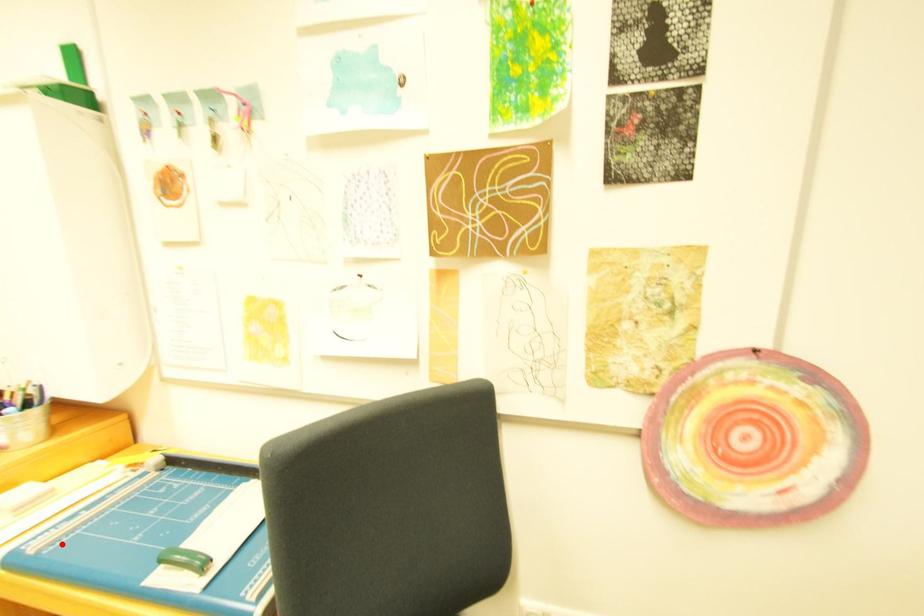
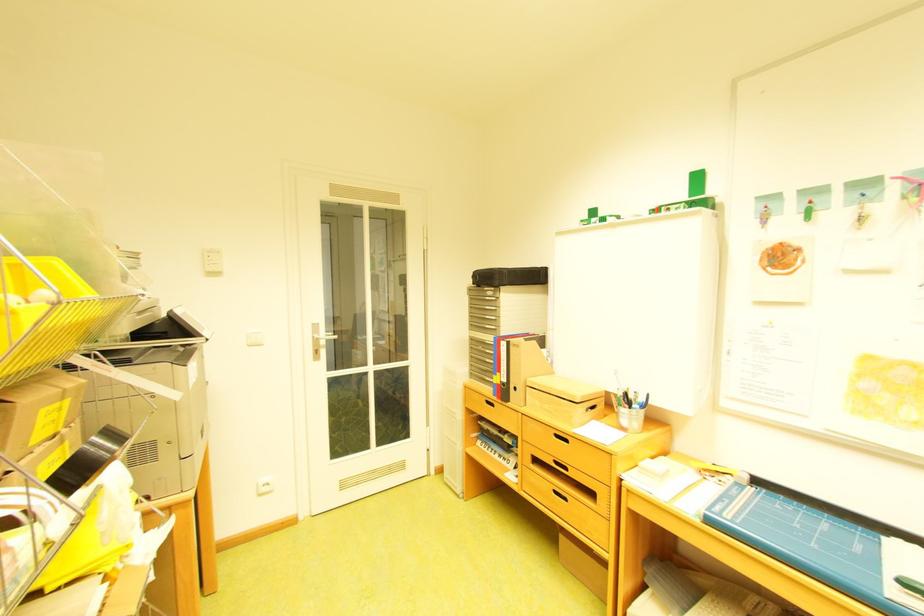
Find the pixel in the second image that matches the highlighted location in the first image.

(747, 517)